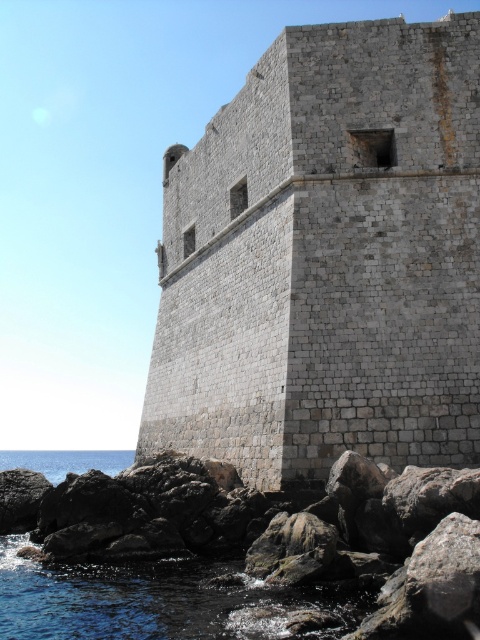
Which is behind, point (392, 193) or point (58, 477)?

Point (58, 477)

Between gray stone wall at center and blue water at lower left, which one appears on the left side from the viewer's perspective?

From the viewer's perspective, blue water at lower left appears more on the left side.

Is point (321, 216) more distant than point (52, 464)?

That is False.

The height and width of the screenshot is (640, 480). What are the coordinates of `gray stone wall at center` in the screenshot? It's located at (326, 259).

Is point (274, 323) closer to camera compared to point (192, 564)?

No, it is behind (192, 564).

Can you confirm if gray stone wall at center is thinner than rough stone rocks at lower left?

Yes, gray stone wall at center is thinner than rough stone rocks at lower left.

The width and height of the screenshot is (480, 640). What do you see at coordinates (326, 259) in the screenshot?
I see `gray stone wall at center` at bounding box center [326, 259].

The width and height of the screenshot is (480, 640). What are the coordinates of `gray stone wall at center` in the screenshot? It's located at (326, 259).

Is point (106, 632) positioned before point (21, 451)?

Yes, point (106, 632) is closer to viewer.

Between point (40, 468) and point (12, 467), which one is positioned in front?

Point (40, 468)

Measure the distance between point (256, 632) and camera.

The distance of point (256, 632) from camera is 75.75 feet.

Find the location of a particular element. rough stone rocks at lower left is located at coordinates (134, 602).